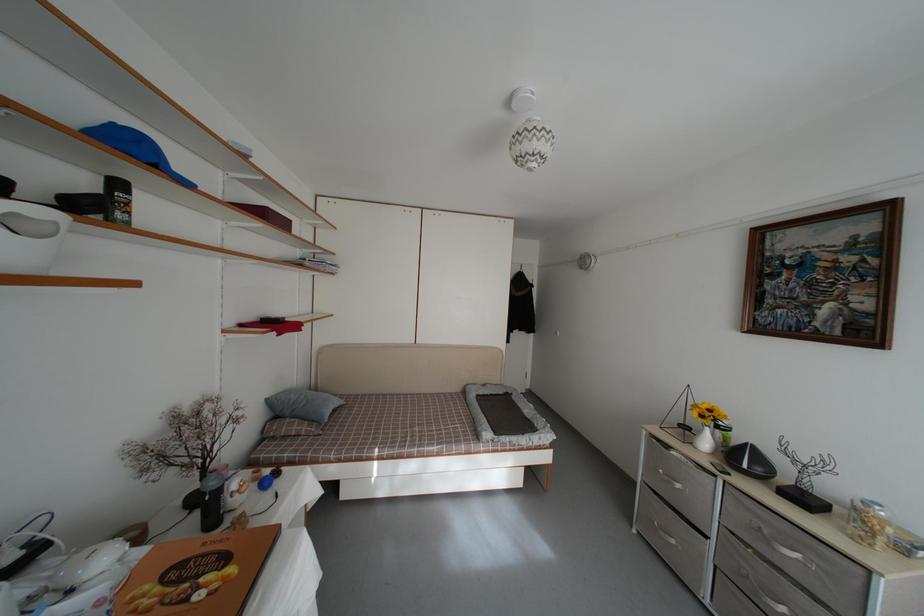
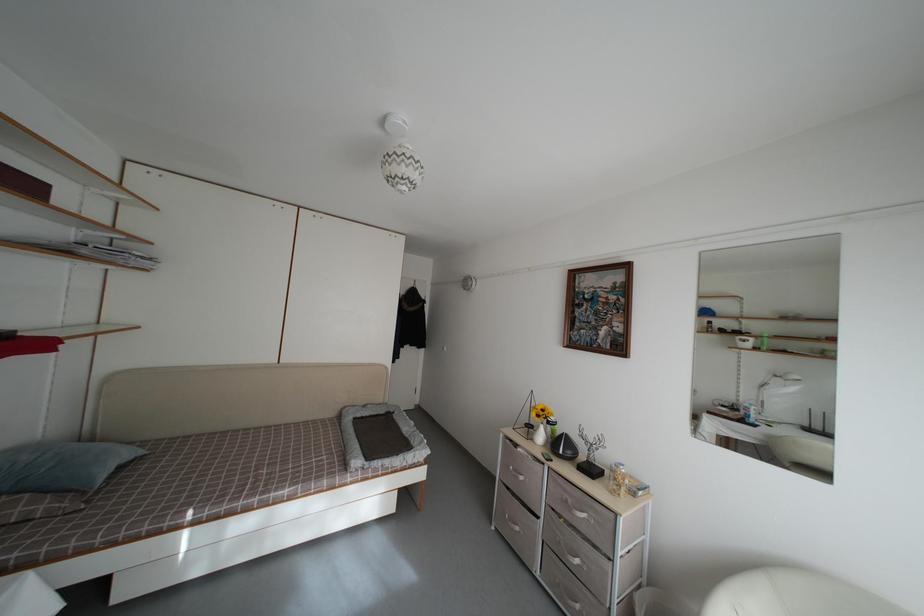
Question: In a continuous first-person perspective shot, in which direction is the camera moving?

Choices:
 (A) Left
 (B) Right
 (C) Forward
 (D) Backward

Answer: (B)